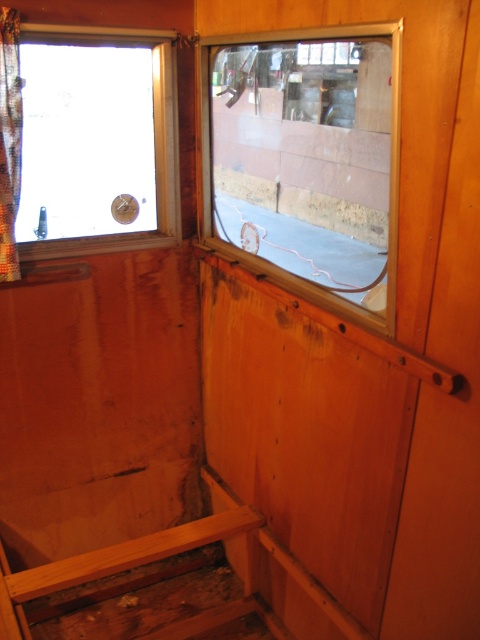
Question: Does clear glass window at upper left have a lesser width compared to satin fabric curtain at left?

Choices:
 (A) yes
 (B) no

Answer: (B)

Question: Can you confirm if clear glass window at center is positioned below satin fabric curtain at left?

Choices:
 (A) yes
 (B) no

Answer: (A)

Question: Does clear glass window at center have a larger size compared to clear glass window at upper left?

Choices:
 (A) yes
 (B) no

Answer: (B)

Question: Among these objects, which one is farthest from the camera?

Choices:
 (A) clear glass window at center
 (B) satin fabric curtain at left

Answer: (B)

Question: Which point appears closest to the camera in this image?

Choices:
 (A) (10, 224)
 (B) (265, 124)
 (C) (117, 232)

Answer: (A)

Question: Which of the following is the closest to the observer?

Choices:
 (A) (283, 172)
 (B) (7, 216)
 (C) (117, 68)

Answer: (B)